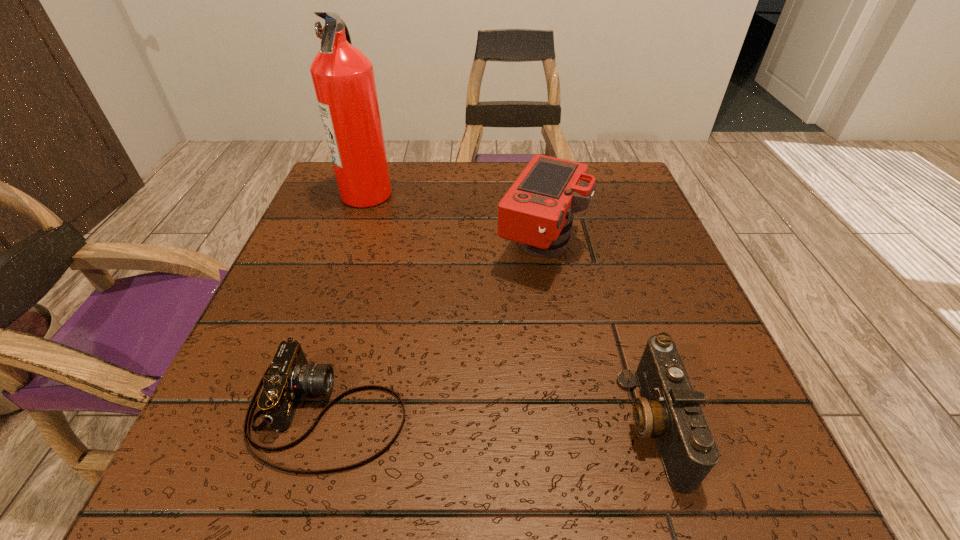
The height and width of the screenshot is (540, 960). Find the location of `free space located on the front-facing side of the second shortest object`. free space located on the front-facing side of the second shortest object is located at coordinates (562, 423).

Where is `free space located 0.210m on the front-facing side of the second shortest object`? Image resolution: width=960 pixels, height=540 pixels. free space located 0.210m on the front-facing side of the second shortest object is located at coordinates (475, 423).

Find the location of a particular element. This screenshot has width=960, height=540. vacant area situated 0.050m on the front-facing side of the shortest object is located at coordinates (442, 411).

The width and height of the screenshot is (960, 540). What are the coordinates of `fire extinguisher that is at the far edge` in the screenshot? It's located at (343, 77).

This screenshot has height=540, width=960. Find the location of `camera that is at the far edge`. camera that is at the far edge is located at coordinates (537, 211).

In order to click on fire extinguisher located in the left edge section of the desktop in this screenshot , I will do `click(343, 77)`.

Identify the location of camera positioned at the left edge. (289, 376).

Find the location of a particular element. Image resolution: width=960 pixels, height=540 pixels. object present at the right edge is located at coordinates (669, 409).

The image size is (960, 540). Identify the location of object present at the far left corner. (343, 77).

At what (x,y) coordinates should I click in order to perform the action: click on object present at the near left corner. Please return your answer as a coordinate pair (x, y). Looking at the image, I should click on (289, 376).